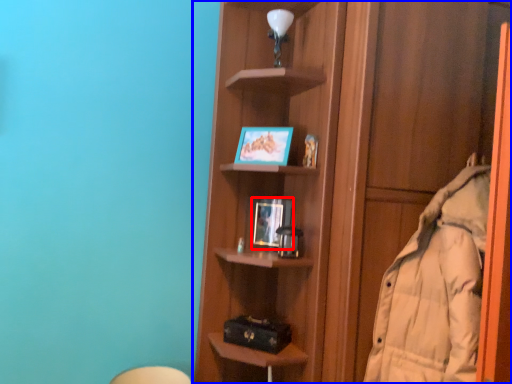
Question: Among these objects, which one is farthest to the camera, picture frame (highlighted by a red box) or shelf (highlighted by a blue box)?

Choices:
 (A) picture frame
 (B) shelf

Answer: (A)